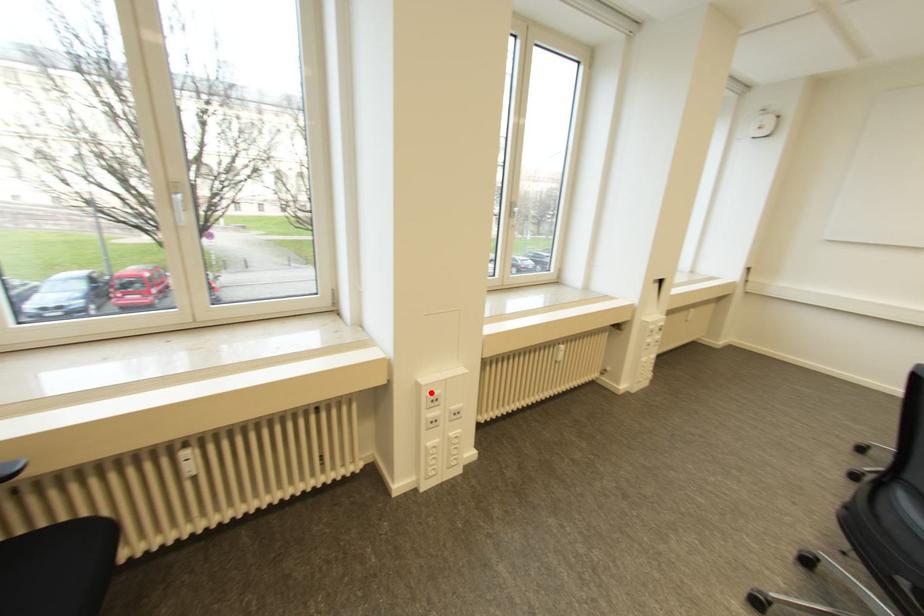
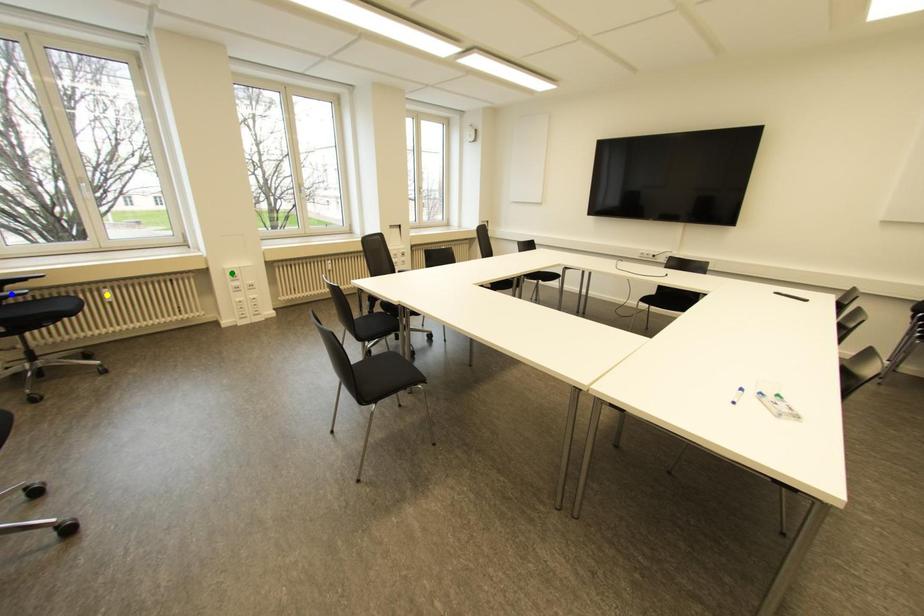
Question: I am providing you with two images of the same scene from different viewpoints. A red point is marked on the first image. You are given multiple points on the second image. Which point in image 2 represents the same 3d spot as the red point in image 1?

Choices:
 (A) green point
 (B) blue point
 (C) yellow point

Answer: (A)